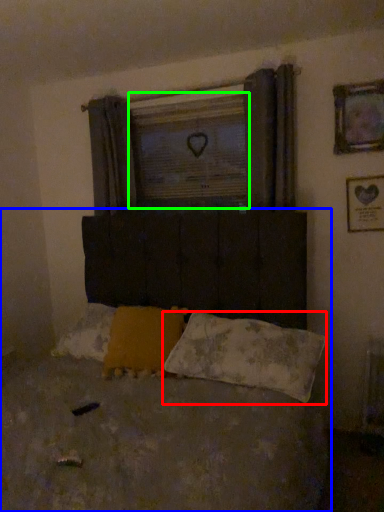
Question: Which object is the farthest from pillow (highlighted by a red box)? Choose among these: bed (highlighted by a blue box) or window screen (highlighted by a green box).

Choices:
 (A) bed
 (B) window screen

Answer: (B)